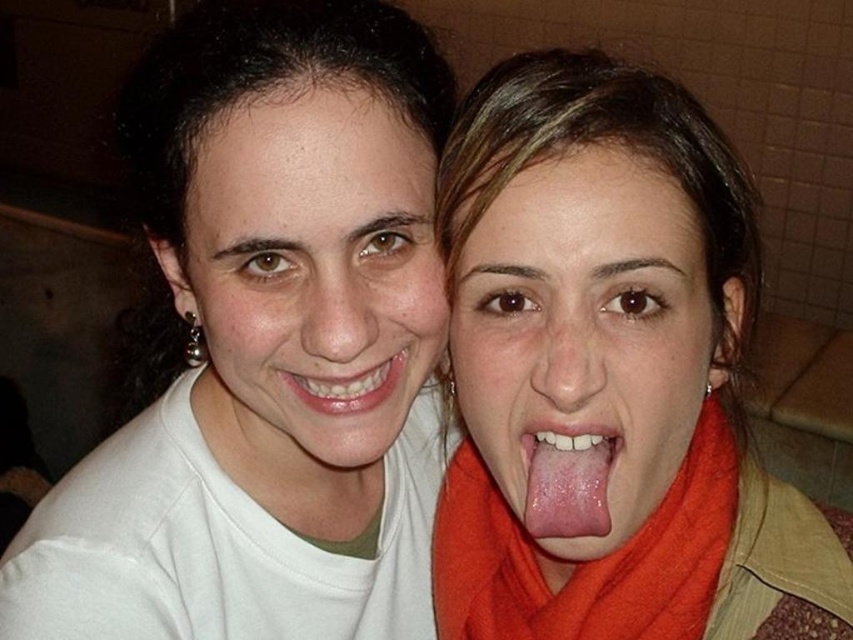
You are a photographer trying to capture a closeup of the matte white face at center in the image. The camera you are using has a very narrow field of view. Can you confirm if the two individuals in the photo are positioned close enough so that both their faces can be captured in a single frame centered at point (309, 276)?

The matte white face at center is located at point (309, 276). Since the camera has a narrow field of view and the frame is centered at that point, only the matte white face at center will be captured. The other individual is positioned away from this central point and likely outside the frame.

From the picture: You are a photographer trying to focus on the matte white face at center in the image. Where exactly should you adjust your camera to capture this subject?

The matte white face at center is located at point coordinates of (x=309, y=276). Adjust your camera to focus precisely at these coordinates to capture the matte white face at center effectively.

You are a photographer trying to focus on the orange fabric scarf at center. What are the coordinates where you should aim your camera?

The orange fabric scarf at center is located at point (585,561), so you should aim your camera at those coordinates to focus on it.